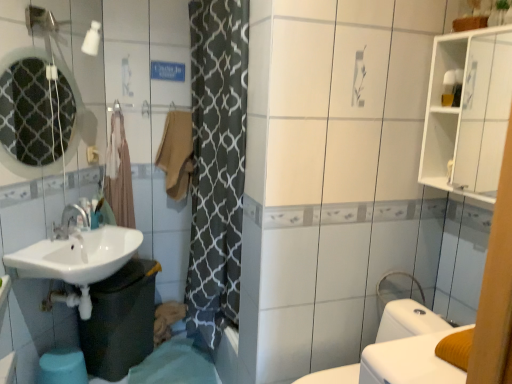
Question: Are white glossy medicine cabinet at upper right and white glossy sink at lower left far apart?

Choices:
 (A) yes
 (B) no

Answer: (A)

Question: From the image's perspective, would you say white glossy medicine cabinet at upper right is shown under white glossy sink at lower left?

Choices:
 (A) yes
 (B) no

Answer: (B)

Question: From a real-world perspective, is white glossy medicine cabinet at upper right below white glossy sink at lower left?

Choices:
 (A) no
 (B) yes

Answer: (A)

Question: Is white glossy medicine cabinet at upper right wider than white glossy sink at lower left?

Choices:
 (A) yes
 (B) no

Answer: (B)

Question: From a real-world perspective, is white glossy medicine cabinet at upper right on white glossy sink at lower left?

Choices:
 (A) yes
 (B) no

Answer: (A)

Question: Is matte glass mirror at upper left spatially inside white glossy medicine cabinet at upper right, or outside of it?

Choices:
 (A) inside
 (B) outside

Answer: (B)

Question: Is matte glass mirror at upper left bigger or smaller than white glossy medicine cabinet at upper right?

Choices:
 (A) small
 (B) big

Answer: (A)

Question: In the image, is matte glass mirror at upper left on the left side or the right side of white glossy medicine cabinet at upper right?

Choices:
 (A) right
 (B) left

Answer: (B)

Question: Is matte glass mirror at upper left wider or thinner than white glossy medicine cabinet at upper right?

Choices:
 (A) thin
 (B) wide

Answer: (A)

Question: In terms of size, does beige fabric towel at center appear bigger or smaller than brown fabric shower curtain at left?

Choices:
 (A) big
 (B) small

Answer: (B)

Question: From their relative heights in the image, would you say beige fabric towel at center is taller or shorter than brown fabric shower curtain at left?

Choices:
 (A) short
 (B) tall

Answer: (A)

Question: Considering the positions of beige fabric towel at center and brown fabric shower curtain at left in the image, is beige fabric towel at center wider or thinner than brown fabric shower curtain at left?

Choices:
 (A) thin
 (B) wide

Answer: (B)

Question: Is beige fabric towel at center inside the boundaries of brown fabric shower curtain at left, or outside?

Choices:
 (A) outside
 (B) inside

Answer: (A)

Question: In terms of height, does beige fabric towel at center look taller or shorter compared to white glossy bidet at lower right?

Choices:
 (A) tall
 (B) short

Answer: (A)

Question: In terms of width, does beige fabric towel at center look wider or thinner when compared to white glossy bidet at lower right?

Choices:
 (A) wide
 (B) thin

Answer: (B)